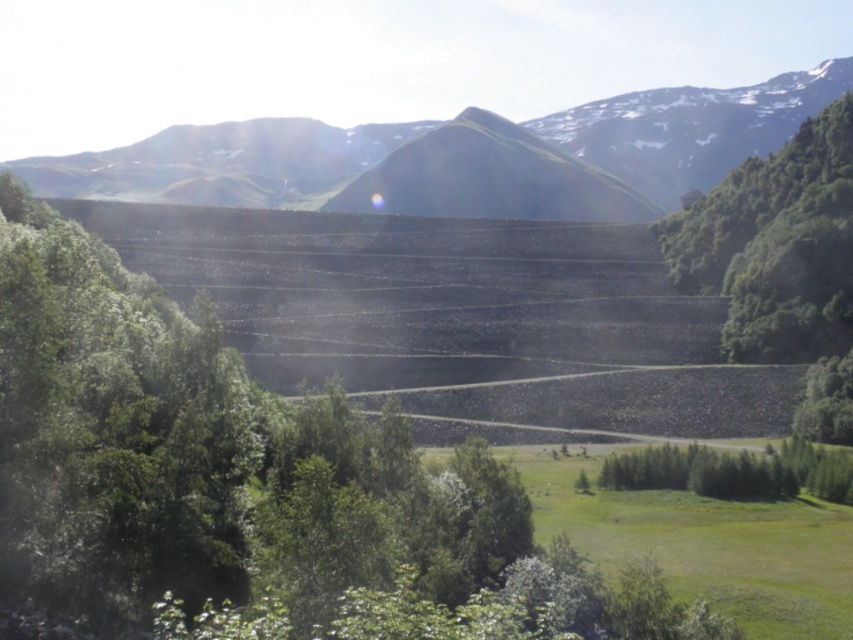
How much distance is there between green leafy tree at right and green grassy hill at center?

A distance of 139.87 meters exists between green leafy tree at right and green grassy hill at center.

Between point (694, 291) and point (469, 182), which one is positioned behind?

Positioned behind is point (469, 182).

In order to click on green leafy tree at right in this screenshot , I will do `click(781, 262)`.

Who is higher up, green grassy mountain at center or green leafy tree at right?

green grassy mountain at center is higher up.

Can you confirm if green grassy mountain at center is positioned to the left of green leafy tree at right?

Correct, you'll find green grassy mountain at center to the left of green leafy tree at right.

Does point (82, 184) come farther from viewer compared to point (813, 314)?

Yes, it is behind point (813, 314).

Locate an element on the screen. This screenshot has width=853, height=640. green grassy mountain at center is located at coordinates (224, 163).

Can you confirm if green grassy mountain at center is wider than green grassy hill at center?

Yes.

Which is above, green grassy mountain at center or green grassy hill at center?

green grassy mountain at center is above.

Who is more forward, [827,93] or [514,163]?

Point [514,163] is in front.

Find the location of a particular element. green grassy mountain at center is located at coordinates (224, 163).